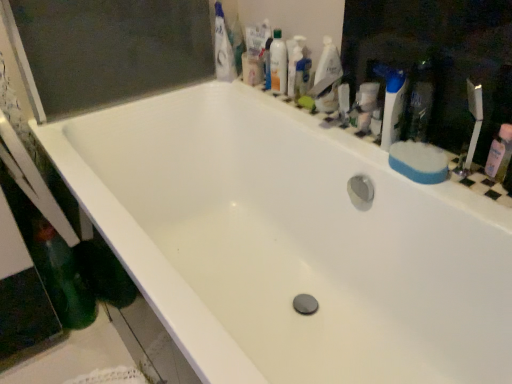
Locate an element on the screen. The height and width of the screenshot is (384, 512). pink plastic mouthwash at right, the first mouthwash positioned from the right is located at coordinates (499, 153).

Where is `translucent plastic mouthwash at upper right, arranged as the 3th mouthwash when viewed from the front`? The image size is (512, 384). translucent plastic mouthwash at upper right, arranged as the 3th mouthwash when viewed from the front is located at coordinates (278, 63).

Image resolution: width=512 pixels, height=384 pixels. What are the coordinates of `green matte bottle at lower left` in the screenshot? It's located at (62, 277).

Find the location of a particular element. This screenshot has width=512, height=384. mouthwash that is the 1st one below the blue plastic toothbrush at upper right (from a real-world perspective) is located at coordinates (294, 63).

From the image's perspective, does translucent plastic mouthwash at upper right, the 2th mouthwash in the left-to-right sequence, appear higher than blue plastic toothbrush at upper right?

Yes, from the image's perspective, translucent plastic mouthwash at upper right, the 2th mouthwash in the left-to-right sequence, is above blue plastic toothbrush at upper right.

From their relative heights in the image, would you say translucent plastic mouthwash at upper right, arranged as the 2th mouthwash when viewed from the back, is taller or shorter than blue plastic toothbrush at upper right?

Considering their sizes, translucent plastic mouthwash at upper right, arranged as the 2th mouthwash when viewed from the back, has less height than blue plastic toothbrush at upper right.

Between translucent plastic mouthwash at upper right, positioned as the second mouthwash in bottom-to-top order, and white glossy bottle at upper right, which one appears on the right side from the viewer's perspective?

From the viewer's perspective, white glossy bottle at upper right appears more on the right side.

From a real-world perspective, relative to white glossy bottle at upper right, is translucent plastic mouthwash at upper right, which is the 2th mouthwash from top to bottom, vertically above or below?

Clearly, from a real-world perspective, translucent plastic mouthwash at upper right, which is the 2th mouthwash from top to bottom, is below white glossy bottle at upper right.

Based on the photo, is translucent plastic mouthwash at upper right, which is the 2th mouthwash from top to bottom, bigger than white glossy bottle at upper right?

→ Correct, translucent plastic mouthwash at upper right, which is the 2th mouthwash from top to bottom, is larger in size than white glossy bottle at upper right.

Between point (81, 279) and point (400, 116), which one is positioned behind?

Point (81, 279)

From the image's perspective, is green matte bottle at lower left below blue plastic toothbrush at upper right?

Yes.

Which object is thinner, green matte bottle at lower left or blue plastic toothbrush at upper right?

With smaller width is blue plastic toothbrush at upper right.

From a real-world perspective, does blue sponge at right sit lower than translucent plastic mouthwash at upper right, which ranks as the 1th mouthwash in back-to-front order?

Yes, from a real-world perspective, blue sponge at right is below translucent plastic mouthwash at upper right, which ranks as the 1th mouthwash in back-to-front order.

Is blue sponge at right in front of or behind translucent plastic mouthwash at upper right, marked as the third mouthwash in a right-to-left arrangement, in the image?

Visually, blue sponge at right is located in front of translucent plastic mouthwash at upper right, marked as the third mouthwash in a right-to-left arrangement.

Is blue sponge at right not inside translucent plastic mouthwash at upper right, positioned as the first mouthwash in top-to-bottom order?

blue sponge at right lies outside translucent plastic mouthwash at upper right, positioned as the first mouthwash in top-to-bottom order,'s area.

Is blue sponge at right oriented towards translucent plastic mouthwash at upper right, the 1th mouthwash positioned from the left?

No, blue sponge at right does not turn towards translucent plastic mouthwash at upper right, the 1th mouthwash positioned from the left.

From a real-world perspective, is green matte bottle at lower left below pink plastic mouthwash at right, the 1th mouthwash positioned from the bottom?

Yes, from a real-world perspective, green matte bottle at lower left is under pink plastic mouthwash at right, the 1th mouthwash positioned from the bottom.

Find the location of a particular element. bottle that is behind the pink plastic mouthwash at right, which is the 1th mouthwash in front-to-back order is located at coordinates (62, 277).

Which object is closer to the camera, green matte bottle at lower left or pink plastic mouthwash at right, the 3th mouthwash when ordered from top to bottom?

pink plastic mouthwash at right, the 3th mouthwash when ordered from top to bottom, is more forward.

From the image's perspective, would you say green matte bottle at lower left is shown under pink plastic mouthwash at right, which is the 1th mouthwash in front-to-back order?

Yes, from the image's perspective, green matte bottle at lower left is below pink plastic mouthwash at right, which is the 1th mouthwash in front-to-back order.

How distant is pink plastic mouthwash at right, which is counted as the 3th mouthwash, starting from the back, from translucent plastic mouthwash at upper right, the 1th mouthwash positioned from the left?

pink plastic mouthwash at right, which is counted as the 3th mouthwash, starting from the back, is 30.34 inches away from translucent plastic mouthwash at upper right, the 1th mouthwash positioned from the left.

Between pink plastic mouthwash at right, the 1th mouthwash positioned from the bottom, and translucent plastic mouthwash at upper right, arranged as the 3th mouthwash when viewed from the front, which one appears on the right side from the viewer's perspective?

Positioned to the right is pink plastic mouthwash at right, the 1th mouthwash positioned from the bottom.

Is point (509, 135) farther from viewer compared to point (279, 38)?

No.

From the image's perspective, does blue plastic toothbrush at upper right appear lower than pink plastic mouthwash at right, the 3th mouthwash when ordered from top to bottom?

No, from the image's perspective, blue plastic toothbrush at upper right is not below pink plastic mouthwash at right, the 3th mouthwash when ordered from top to bottom.

Does blue plastic toothbrush at upper right have a lesser width compared to pink plastic mouthwash at right, the 3th mouthwash when ordered from top to bottom?

In fact, blue plastic toothbrush at upper right might be wider than pink plastic mouthwash at right, the 3th mouthwash when ordered from top to bottom.

Is blue plastic toothbrush at upper right completely or partially outside of pink plastic mouthwash at right, the 1th mouthwash positioned from the bottom?

blue plastic toothbrush at upper right lies outside pink plastic mouthwash at right, the 1th mouthwash positioned from the bottom,'s area.

Would you say blue plastic toothbrush at upper right is to the left or to the right of pink plastic mouthwash at right, the 1th mouthwash positioned from the bottom, in the picture?

Based on their positions, blue plastic toothbrush at upper right is located to the left of pink plastic mouthwash at right, the 1th mouthwash positioned from the bottom.

The image size is (512, 384). What are the coordinates of `toiletry above the translucent plastic mouthwash at upper right, the second mouthwash in the front-to-back sequence (from a real-world perspective)` in the screenshot? It's located at (392, 104).

From the white glossy bottle at upper right, count the 1st mouthwash to the left and point to it. Please provide its 2D coordinates.

[(294, 63)]

Which object lies nearer to the anchor point translucent plastic mouthwash at upper right, positioned as the 2th mouthwash in right-to-left order, green matte bottle at lower left or translucent plastic mouthwash at upper right, the 1th mouthwash positioned from the left?

translucent plastic mouthwash at upper right, the 1th mouthwash positioned from the left, lies closer to translucent plastic mouthwash at upper right, positioned as the 2th mouthwash in right-to-left order, than the other object.

Based on their spatial positions, is translucent plastic mouthwash at upper right, positioned as the first mouthwash in top-to-bottom order, or white glossy bottle at upper right further from translucent plastic mouthwash at upper right, the second mouthwash in the front-to-back sequence?

Based on the image, white glossy bottle at upper right appears to be further to translucent plastic mouthwash at upper right, the second mouthwash in the front-to-back sequence.

From the image, which object appears to be farther from blue sponge at right, translucent plastic mouthwash at upper right, arranged as the 3th mouthwash when viewed from the front, or pink plastic mouthwash at right, the 3th mouthwash when ordered from top to bottom?

Based on the image, translucent plastic mouthwash at upper right, arranged as the 3th mouthwash when viewed from the front, appears to be further to blue sponge at right.

Based on their spatial positions, is translucent plastic mouthwash at upper right, the second mouthwash in the front-to-back sequence, or blue sponge at right further from white glossy toothpaste at upper center?

blue sponge at right.

When comparing their distances from green matte bottle at lower left, does blue plastic toothbrush at upper right or pink plastic mouthwash at right, which is counted as the 3th mouthwash, starting from the back, seem closer?

blue plastic toothbrush at upper right lies closer to green matte bottle at lower left than the other object.

Looking at the image, which one is located further to green matte bottle at lower left, white glossy toothpaste at upper center or pink plastic mouthwash at right, the 1th mouthwash positioned from the bottom?

pink plastic mouthwash at right, the 1th mouthwash positioned from the bottom.

Looking at the image, which one is located closer to white glossy bottle at upper right, green matte bottle at lower left or blue plastic toothbrush at upper right?

Among the two, blue plastic toothbrush at upper right is located nearer to white glossy bottle at upper right.

Looking at the image, which one is located further to green matte bottle at lower left, pink plastic mouthwash at right, the first mouthwash positioned from the right, or blue sponge at right?

pink plastic mouthwash at right, the first mouthwash positioned from the right.

The image size is (512, 384). Find the location of `soap situated between green matte bottle at lower left and pink plastic mouthwash at right, which is the 1th mouthwash in front-to-back order, from left to right`. soap situated between green matte bottle at lower left and pink plastic mouthwash at right, which is the 1th mouthwash in front-to-back order, from left to right is located at coordinates (419, 162).

What are the coordinates of `mouthwash located between blue sponge at right and translucent plastic mouthwash at upper right, which is the third mouthwash from bottom to top, in the depth direction` in the screenshot? It's located at (294, 63).

Image resolution: width=512 pixels, height=384 pixels. What are the coordinates of `toiletry located between blue sponge at right and white glossy bottle at upper right in the depth direction` in the screenshot? It's located at (392, 104).

The image size is (512, 384). I want to click on cleaning product between translucent plastic mouthwash at upper right, marked as the third mouthwash in a right-to-left arrangement, and pink plastic mouthwash at right, the 3th mouthwash when ordered from top to bottom, from left to right, so click(327, 69).